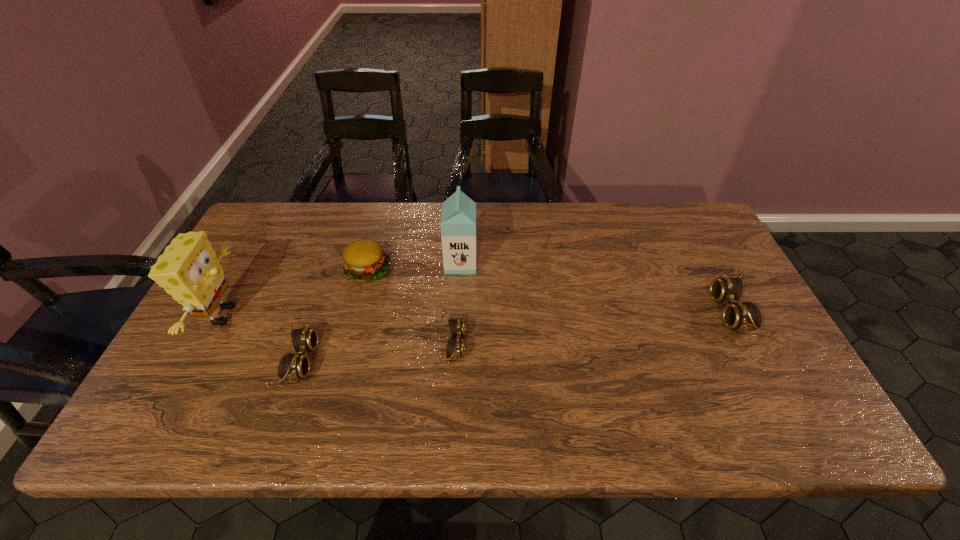
To make them evenly spaced by inserting another goggles among them, please locate a free space for this new goggles. Please provide its 2D coordinates. Your answer should be formatted as a tuple, i.e. [(x, y)], where the tuple contains the x and y coordinates of a point satisfying the conditions above.

[(597, 328)]